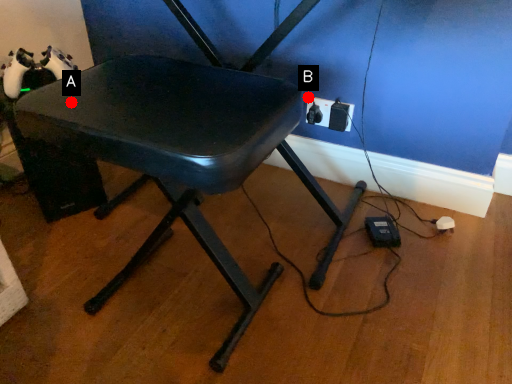
Question: Two points are circled on the image, labeled by A and B beside each circle. Which point is farther to the camera?

Choices:
 (A) A is further
 (B) B is further

Answer: (B)